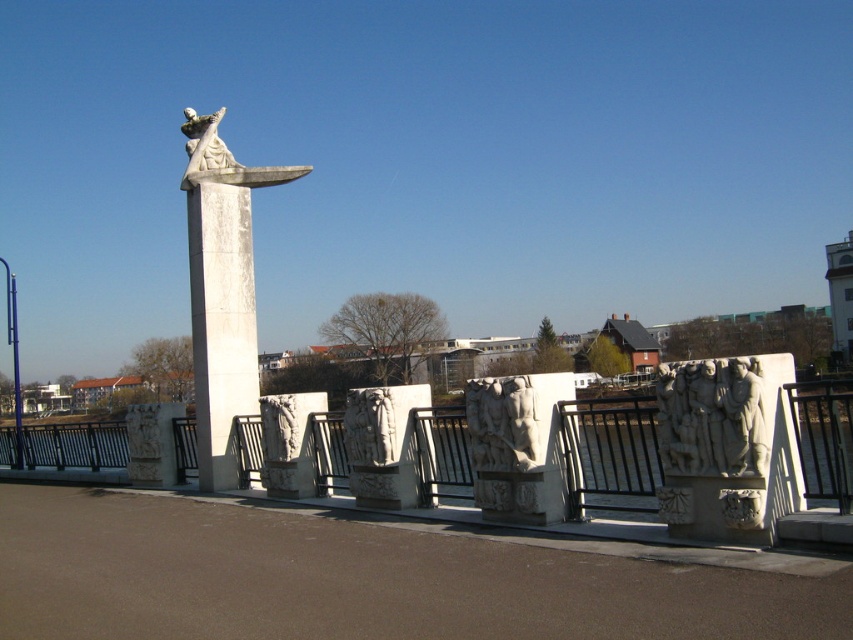
Consider the image. You are an architect analyzing the structural integrity of the white stone statue at center and the white stone statue at upper center. Which statue has a smaller base area to support its weight?

The white stone statue at center is thinner than the white stone statue at upper center, so it has a smaller base area to support its weight.

You are standing 10 meters away from the central column in the image. If you walk towards the point at coordinates point (196, 211), will you get closer to the central column?

The distance of point (196, 211) from viewer is 13.00 meters. Since you are currently 10 meters away from the central column, walking towards the point would take you further away from the central column.

You are an architect examining the structure and need to determine the relative heights of the white stone carving at right and the white stone statue at upper center. Which one is taller?

The white stone statue at upper center is taller than the white stone carving at right.